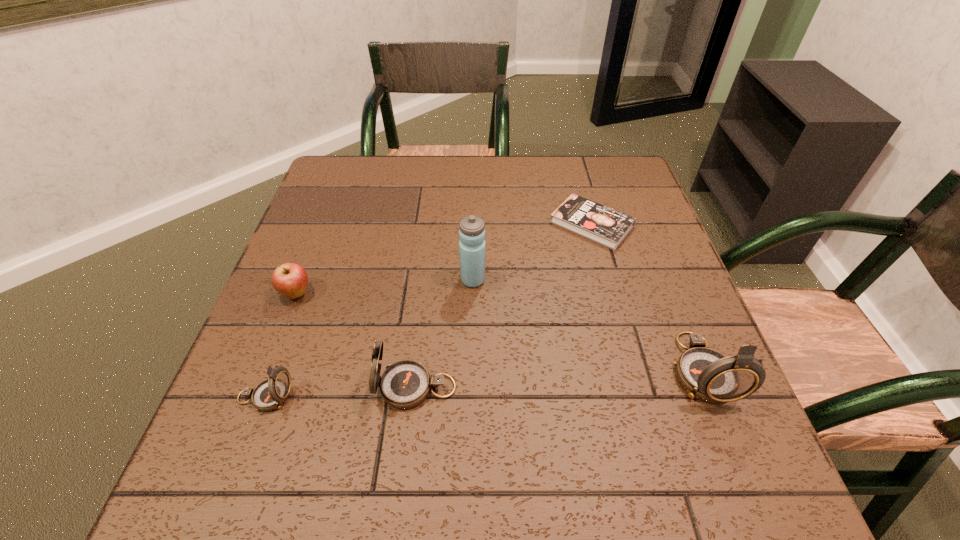
Locate an element on the screen. Image resolution: width=960 pixels, height=540 pixels. the shortest compass is located at coordinates (270, 394).

The width and height of the screenshot is (960, 540). What are the coordinates of `the fourth object from right to left` in the screenshot? It's located at (405, 384).

At what (x,y) coordinates should I click in order to perform the action: click on the fourth shortest object. Please return your answer as a coordinate pair (x, y). Image resolution: width=960 pixels, height=540 pixels. Looking at the image, I should click on (405, 384).

I want to click on the rightmost compass, so click(x=706, y=374).

Where is `apple`? The width and height of the screenshot is (960, 540). apple is located at coordinates (289, 279).

In order to click on the farthest object in this screenshot , I will do click(608, 227).

The height and width of the screenshot is (540, 960). In order to click on book in this screenshot , I will do `click(608, 227)`.

Find the location of `the third object from right to left`. the third object from right to left is located at coordinates (472, 229).

Locate an element on the screen. vacant region located on the face of the shortest compass is located at coordinates (502, 397).

In order to click on vacant position located 0.170m on the face of the second tallest compass in this screenshot , I will do `click(283, 387)`.